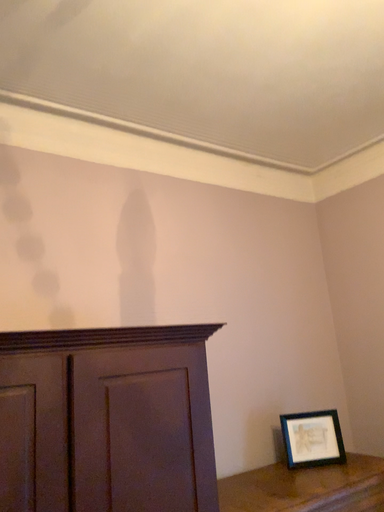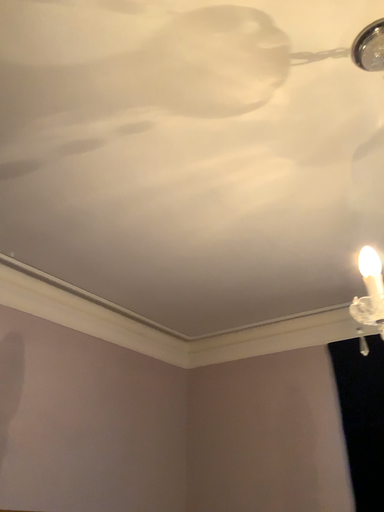
Question: How did the camera likely rotate when shooting the video?

Choices:
 (A) rotated right
 (B) rotated left

Answer: (A)